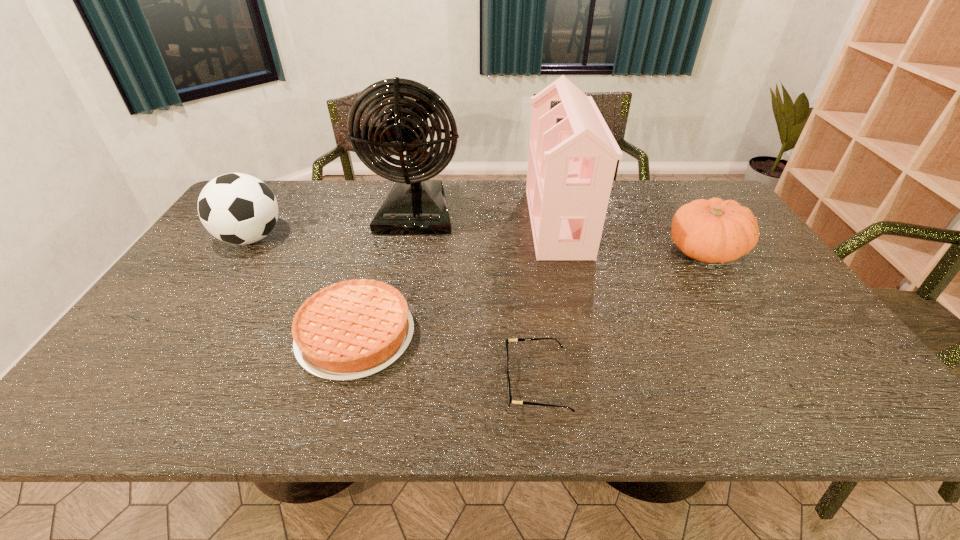
Where is `vacant area situated on the front-facing side of the dollhouse`? The width and height of the screenshot is (960, 540). vacant area situated on the front-facing side of the dollhouse is located at coordinates pos(469,222).

Locate an element on the screen. free location located 0.360m on the front-facing side of the dollhouse is located at coordinates (417, 222).

Find the location of `free space located on the back of the leftmost object`. free space located on the back of the leftmost object is located at coordinates (290, 180).

Identify the location of free space located on the back of the rightmost object. The width and height of the screenshot is (960, 540). (666, 187).

In order to click on free space located on the right of the fifth tallest object in this screenshot , I will do `click(506, 335)`.

This screenshot has height=540, width=960. In order to click on vacant space positioned on the front-facing side of the spectacles in this screenshot , I will do `click(368, 383)`.

Identify the location of vacant point located on the front-facing side of the spectacles. This screenshot has height=540, width=960. (433, 383).

The height and width of the screenshot is (540, 960). I want to click on free spot located on the front-facing side of the spectacles, so click(428, 383).

Locate an element on the screen. fan that is at the far edge is located at coordinates (416, 205).

I want to click on dollhouse that is at the far edge, so click(x=571, y=165).